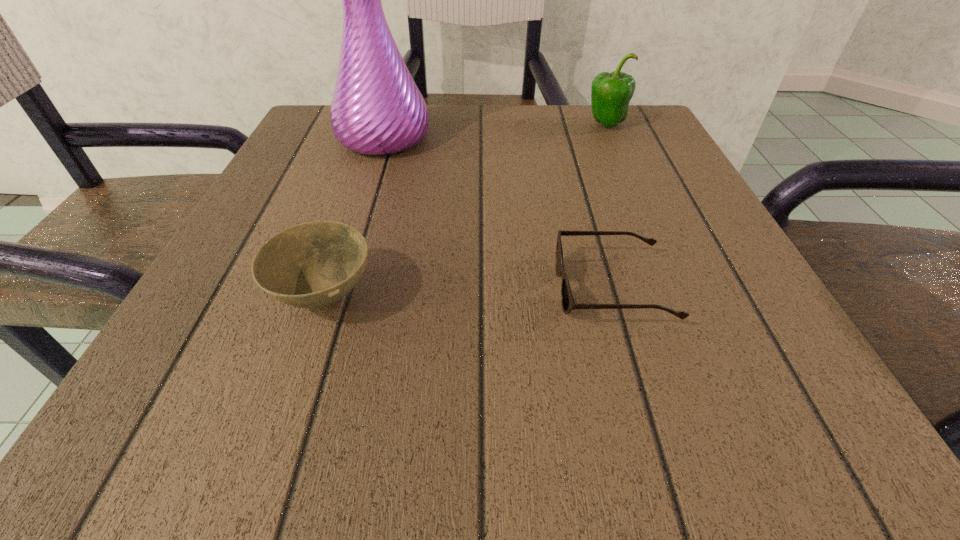
This screenshot has height=540, width=960. In order to click on vase that is at the far edge in this screenshot , I will do `click(377, 109)`.

At what (x,y) coordinates should I click in order to perform the action: click on bell pepper that is at the far edge. Please return your answer as a coordinate pair (x, y). The width and height of the screenshot is (960, 540). Looking at the image, I should click on 611,93.

Where is `vase present at the left edge`? This screenshot has width=960, height=540. vase present at the left edge is located at coordinates (377, 109).

Find the location of a particular element. This screenshot has height=540, width=960. bowl that is at the left edge is located at coordinates (312, 265).

The width and height of the screenshot is (960, 540). I want to click on bell pepper present at the right edge, so click(611, 93).

Where is `sunglasses that is at the right edge`? The height and width of the screenshot is (540, 960). sunglasses that is at the right edge is located at coordinates (568, 304).

Where is `object that is at the far left corner`? The height and width of the screenshot is (540, 960). object that is at the far left corner is located at coordinates (377, 109).

At what (x,y) coordinates should I click in order to perform the action: click on object that is positioned at the far right corner. Please return your answer as a coordinate pair (x, y). The height and width of the screenshot is (540, 960). Looking at the image, I should click on (611, 93).

This screenshot has width=960, height=540. What are the coordinates of `free space at the far edge of the desktop` in the screenshot? It's located at (541, 144).

You are a GUI agent. You are given a task and a screenshot of the screen. Output one action in this format:
    pyautogui.click(x=<x>, y=<y>)
    Task: Click on the vacant region at the near edge of the desktop
    Image resolution: width=960 pixels, height=540 pixels.
    Given the screenshot: What is the action you would take?
    pos(506,399)